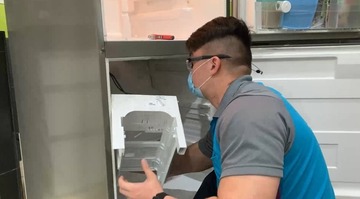
At what (x,y) coordinates should I click in order to perform the action: click on freezer. Please return your answer as a coordinate pair (x, y). This screenshot has height=199, width=360. Looking at the image, I should click on (167, 11).